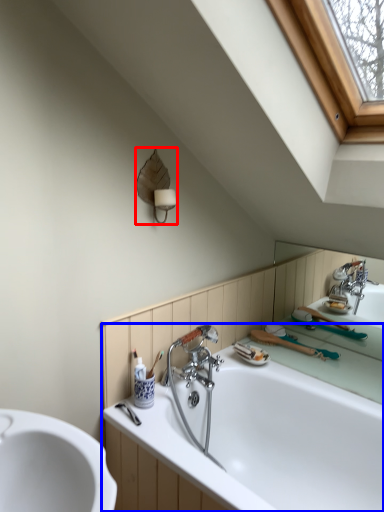
Question: Which point is closer to the camera, fixture (highlighted by a red box) or bathtub (highlighted by a blue box)?

Choices:
 (A) fixture
 (B) bathtub

Answer: (B)